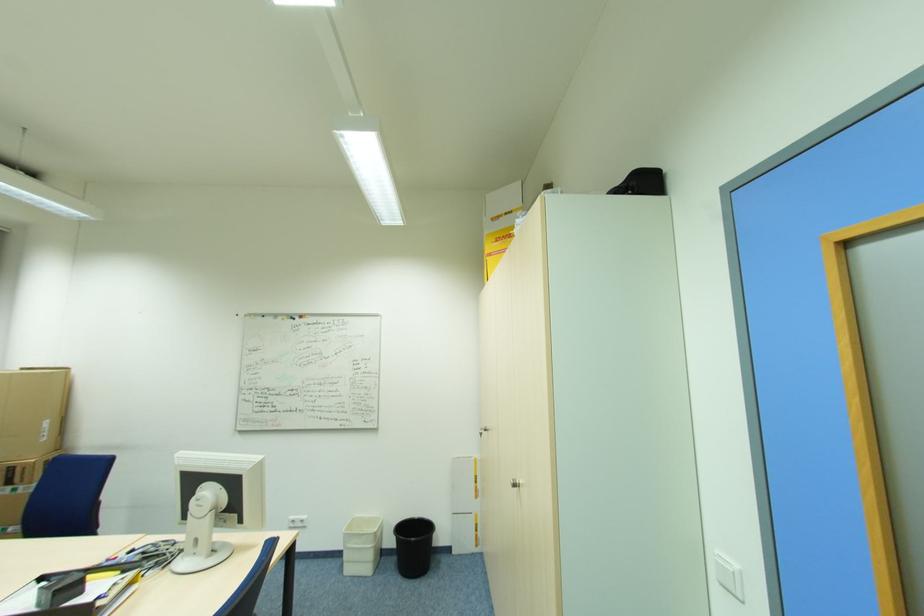
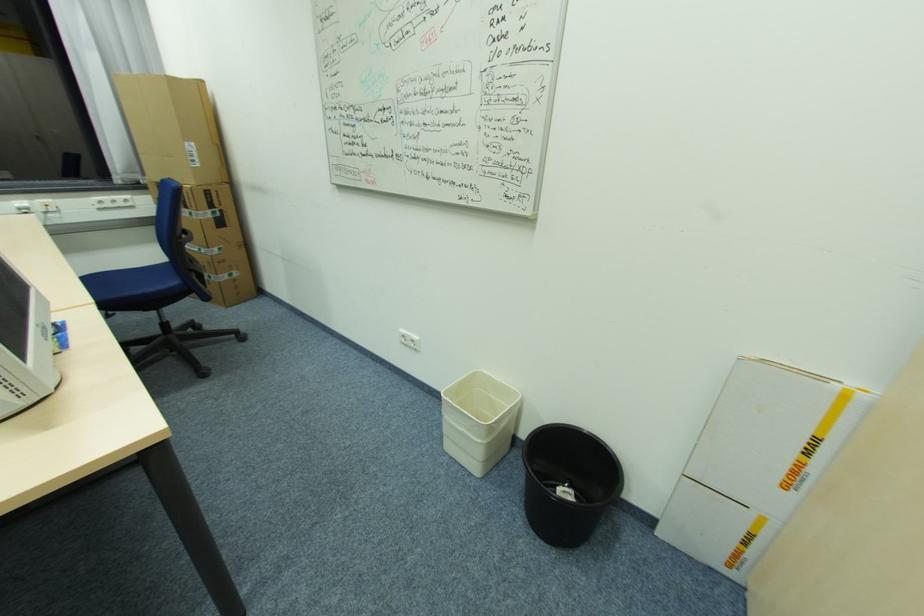
In the second image, find the point that corresponds to pixel 479 525 in the first image.

(752, 535)